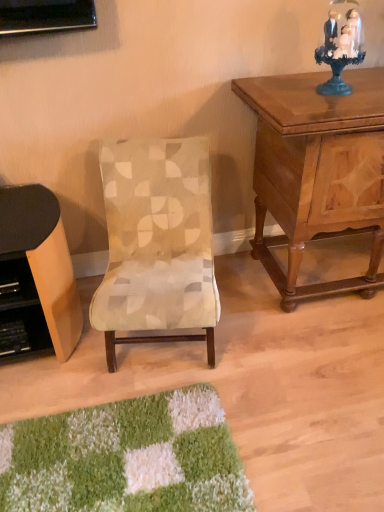
Find the location of a particular element. free space to the right of beige fabric chair at center is located at coordinates (268, 345).